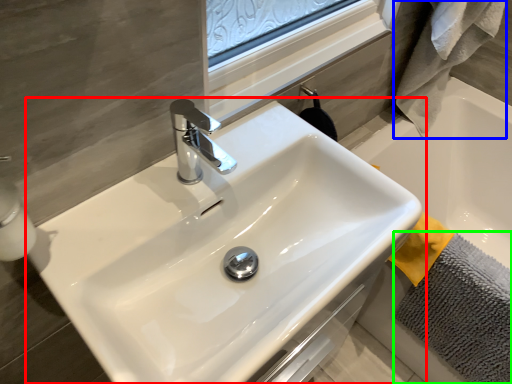
Question: Which is farther away from sink (highlighted by a red box)? bath towel (highlighted by a blue box) or bath towel (highlighted by a green box)?

Choices:
 (A) bath towel
 (B) bath towel

Answer: (A)